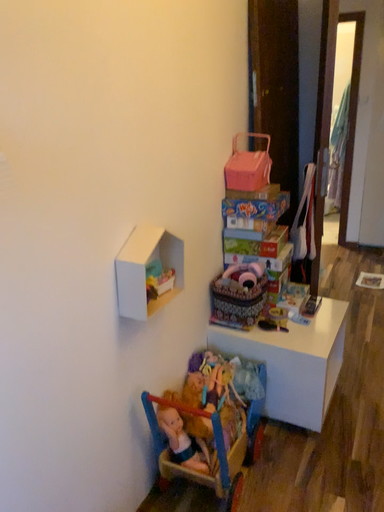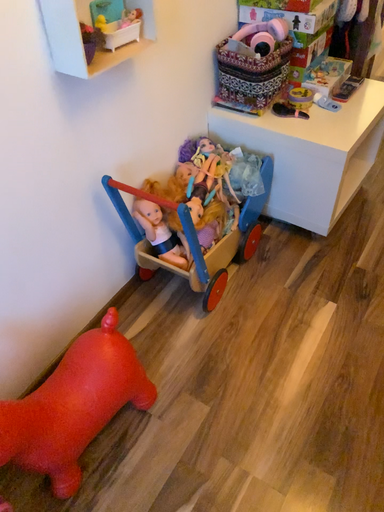
Question: How did the camera likely rotate when shooting the video?

Choices:
 (A) rotated right
 (B) rotated left

Answer: (B)